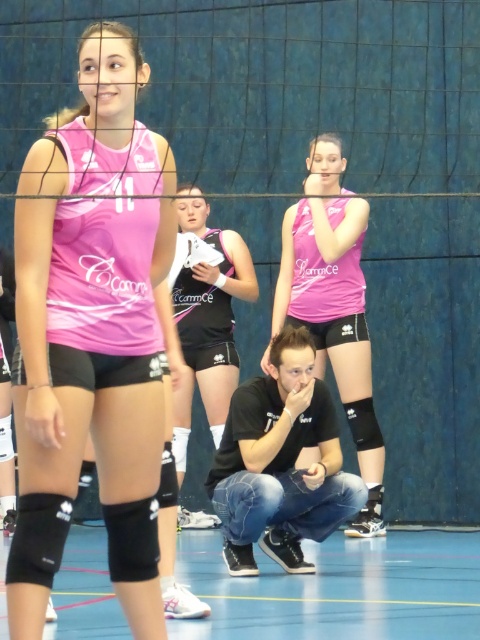
Which is more to the right, pink matte jersey at center or black matte shorts at center?

Positioned to the right is pink matte jersey at center.

Is pink matte jersey at center to the left of black matte shorts at center from the viewer's perspective?

In fact, pink matte jersey at center is to the right of black matte shorts at center.

Between point (320, 256) and point (214, 296), which one is positioned in front?

Point (320, 256) is more forward.

The width and height of the screenshot is (480, 640). In order to click on pink matte jersey at center in this screenshot , I will do `click(334, 305)`.

Is point (228, 451) closer to viewer compared to point (204, 376)?

Yes.

The width and height of the screenshot is (480, 640). Describe the element at coordinates (280, 464) in the screenshot. I see `black denim jeans at center` at that location.

Locate an element on the screen. Image resolution: width=480 pixels, height=640 pixels. black denim jeans at center is located at coordinates (280, 464).

Can you confirm if matte pink jersey at center is positioned to the right of pink matte jersey at center?

No, matte pink jersey at center is not to the right of pink matte jersey at center.

The width and height of the screenshot is (480, 640). What do you see at coordinates (92, 332) in the screenshot? I see `matte pink jersey at center` at bounding box center [92, 332].

You are a GUI agent. You are given a task and a screenshot of the screen. Output one action in this format:
    pyautogui.click(x=<x>, y=<y>)
    Task: Click on the matte pink jersey at center
    
    Given the screenshot: What is the action you would take?
    click(x=92, y=332)